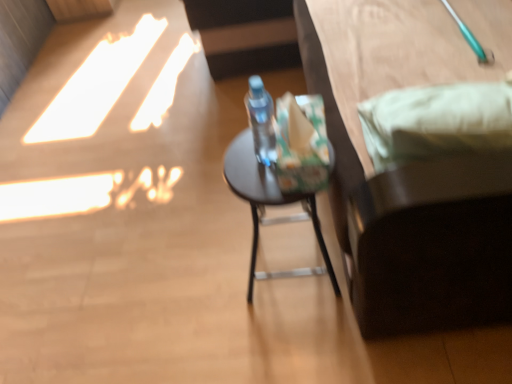
Find the location of `vacant space in front of transparent plastic bottle at center`. vacant space in front of transparent plastic bottle at center is located at coordinates (265, 182).